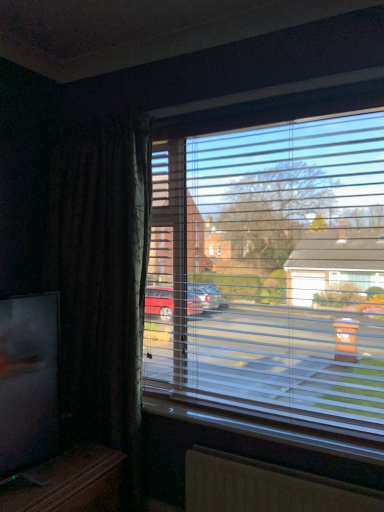
Question: Is brown textured radiator at lower center to the right of transparent plastic blinds at center from the viewer's perspective?

Choices:
 (A) yes
 (B) no

Answer: (A)

Question: Can you see brown textured radiator at lower center touching transparent plastic blinds at center?

Choices:
 (A) yes
 (B) no

Answer: (B)

Question: Does brown textured radiator at lower center have a lesser width compared to transparent plastic blinds at center?

Choices:
 (A) no
 (B) yes

Answer: (A)

Question: Can you confirm if brown textured radiator at lower center is smaller than transparent plastic blinds at center?

Choices:
 (A) yes
 (B) no

Answer: (A)

Question: From a real-world perspective, is brown textured radiator at lower center over transparent plastic blinds at center?

Choices:
 (A) no
 (B) yes

Answer: (A)

Question: Is brown textured radiator at lower center taller than transparent plastic blinds at center?

Choices:
 (A) yes
 (B) no

Answer: (B)

Question: Is matte black tv at lower left positioned before transparent plastic blinds at center?

Choices:
 (A) no
 (B) yes

Answer: (B)

Question: Can you confirm if matte black tv at lower left is positioned to the left of transparent plastic blinds at center?

Choices:
 (A) no
 (B) yes

Answer: (B)

Question: Considering the relative sizes of matte black tv at lower left and transparent plastic blinds at center in the image provided, is matte black tv at lower left shorter than transparent plastic blinds at center?

Choices:
 (A) yes
 (B) no

Answer: (A)

Question: Considering the relative sizes of matte black tv at lower left and transparent plastic blinds at center in the image provided, is matte black tv at lower left thinner than transparent plastic blinds at center?

Choices:
 (A) yes
 (B) no

Answer: (B)

Question: Is matte black tv at lower left taller than transparent plastic blinds at center?

Choices:
 (A) yes
 (B) no

Answer: (B)

Question: Considering the relative positions of matte black tv at lower left and transparent plastic blinds at center in the image provided, is matte black tv at lower left to the right of transparent plastic blinds at center from the viewer's perspective?

Choices:
 (A) yes
 (B) no

Answer: (B)

Question: Is transparent plastic blinds at center beside white plastic window sill at lower center?

Choices:
 (A) no
 (B) yes

Answer: (A)